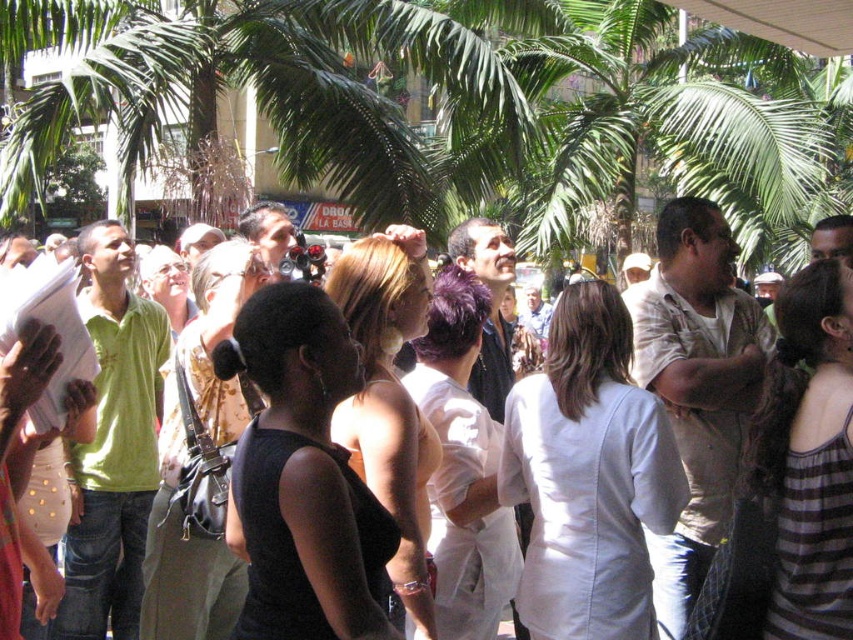
Question: Does green leafy palm tree at center have a larger size compared to matte black dress at center?

Choices:
 (A) no
 (B) yes

Answer: (B)

Question: Is green leafy palm tree at center closer to camera compared to matte black dress at center?

Choices:
 (A) yes
 (B) no

Answer: (B)

Question: Which of the following is the farthest from the observer?

Choices:
 (A) matte black dress at center
 (B) green leafy palm tree at center

Answer: (B)

Question: Which of the following is the farthest from the observer?

Choices:
 (A) (674, 288)
 (B) (209, 33)

Answer: (B)

Question: Is the position of green leafy palm tree at center more distant than that of matte black dress at center?

Choices:
 (A) no
 (B) yes

Answer: (B)